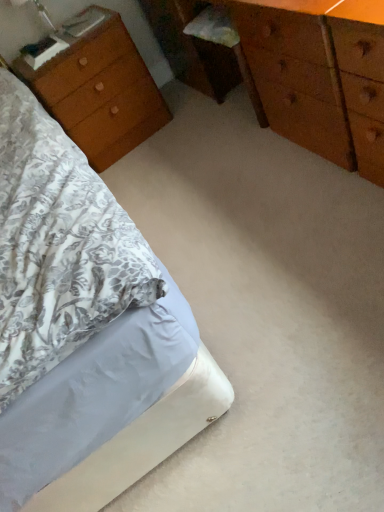
The width and height of the screenshot is (384, 512). Describe the element at coordinates (295, 70) in the screenshot. I see `wooden chest of drawers at center` at that location.

At what (x,y) coordinates should I click in order to perform the action: click on white fabric bed at lower left. Please return your answer as a coordinate pair (x, y). Looking at the image, I should click on (85, 329).

Considering the relative sizes of wooden nightstand at left and white fabric bed at lower left in the image provided, is wooden nightstand at left bigger than white fabric bed at lower left?

No, wooden nightstand at left is not bigger than white fabric bed at lower left.

Is wooden nightstand at left thinner than white fabric bed at lower left?

Indeed, wooden nightstand at left has a lesser width compared to white fabric bed at lower left.

Which of these two, wooden nightstand at left or white fabric bed at lower left, stands taller?

wooden nightstand at left.

From the picture: Is wooden nightstand at left aimed at white fabric bed at lower left?

Yes, wooden nightstand at left is aimed at white fabric bed at lower left.

Considering the sizes of objects wooden chest of drawers at center and wooden nightstand at left in the image provided, who is wider, wooden chest of drawers at center or wooden nightstand at left?

wooden nightstand at left is wider.

From the picture: Is wooden chest of drawers at center touching wooden nightstand at left?

No, wooden chest of drawers at center is not in contact with wooden nightstand at left.

In the image, is wooden chest of drawers at center positioned in front of or behind wooden nightstand at left?

wooden chest of drawers at center is positioned closer to the viewer than wooden nightstand at left.

Is white fabric bed at lower left facing towards wooden chest of drawers at center?

No, white fabric bed at lower left is not turned towards wooden chest of drawers at center.

Which is in front, white fabric bed at lower left or wooden chest of drawers at center?

white fabric bed at lower left is more forward.

Does white fabric bed at lower left have a larger size compared to wooden chest of drawers at center?

Incorrect, white fabric bed at lower left is not larger than wooden chest of drawers at center.

Considering the positions of points (5, 178) and (323, 40), is point (5, 178) closer to camera compared to point (323, 40)?

Yes, point (5, 178) is in front of point (323, 40).

Image resolution: width=384 pixels, height=512 pixels. Find the location of `chest of drawers in front of the wooden nightstand at left`. chest of drawers in front of the wooden nightstand at left is located at coordinates (295, 70).

From a real-world perspective, which is physically below, wooden nightstand at left or wooden chest of drawers at center?

wooden nightstand at left, from a real-world perspective.

Is wooden nightstand at left situated inside wooden chest of drawers at center or outside?

wooden nightstand at left cannot be found inside wooden chest of drawers at center.

Who is bigger, wooden nightstand at left or wooden chest of drawers at center?

wooden chest of drawers at center is bigger.

Can you confirm if white fabric bed at lower left is positioned to the left of wooden nightstand at left?

No.

Is white fabric bed at lower left bigger than wooden nightstand at left?

Yes.

I want to click on nightstand above the white fabric bed at lower left (from a real-world perspective), so click(x=100, y=93).

Is white fabric bed at lower left outside of wooden nightstand at left?

Absolutely, white fabric bed at lower left is external to wooden nightstand at left.

Could you tell me if wooden chest of drawers at center is facing white fabric bed at lower left?

Yes, wooden chest of drawers at center is turned towards white fabric bed at lower left.

Considering the sizes of wooden chest of drawers at center and white fabric bed at lower left in the image, is wooden chest of drawers at center wider or thinner than white fabric bed at lower left?

In the image, wooden chest of drawers at center appears to be more narrow than white fabric bed at lower left.

From a real-world perspective, which object stands above the other?

wooden chest of drawers at center is physically above.

Does point (271, 54) appear closer or farther from the camera than point (156, 428)?

Point (271, 54) appears to be farther away from the viewer than point (156, 428).

You are a GUI agent. You are given a task and a screenshot of the screen. Output one action in this format:
    pyautogui.click(x=<x>, y=<y>)
    Task: Click on the bed below the wooden nightstand at left (from a real-world perspective)
    Image resolution: width=384 pixels, height=512 pixels.
    Given the screenshot: What is the action you would take?
    pyautogui.click(x=85, y=329)

At what (x,y) coordinates should I click in order to perform the action: click on nightstand below the wooden chest of drawers at center (from the image's perspective). Please return your answer as a coordinate pair (x, y). The width and height of the screenshot is (384, 512). Looking at the image, I should click on (100, 93).

Looking at this image, considering their positions, is white fabric bed at lower left positioned further to wooden nightstand at left than wooden chest of drawers at center?

The object further to wooden nightstand at left is white fabric bed at lower left.

Looking at the image, which one is located closer to white fabric bed at lower left, wooden nightstand at left or wooden chest of drawers at center?

wooden nightstand at left is closer to white fabric bed at lower left.

Which object lies further to the anchor point wooden chest of drawers at center, white fabric bed at lower left or wooden nightstand at left?

white fabric bed at lower left lies further to wooden chest of drawers at center than the other object.

Which object lies nearer to the anchor point white fabric bed at lower left, wooden chest of drawers at center or wooden nightstand at left?

wooden nightstand at left is positioned closer to the anchor white fabric bed at lower left.

Based on their spatial positions, is wooden nightstand at left or white fabric bed at lower left further from wooden chest of drawers at center?

white fabric bed at lower left is further to wooden chest of drawers at center.

When comparing their distances from wooden nightstand at left, does wooden chest of drawers at center or white fabric bed at lower left seem further?

Based on the image, white fabric bed at lower left appears to be further to wooden nightstand at left.

The width and height of the screenshot is (384, 512). Find the location of `the chest of drawers positioned between white fabric bed at lower left and wooden nightstand at left from near to far`. the chest of drawers positioned between white fabric bed at lower left and wooden nightstand at left from near to far is located at coordinates [x=295, y=70].